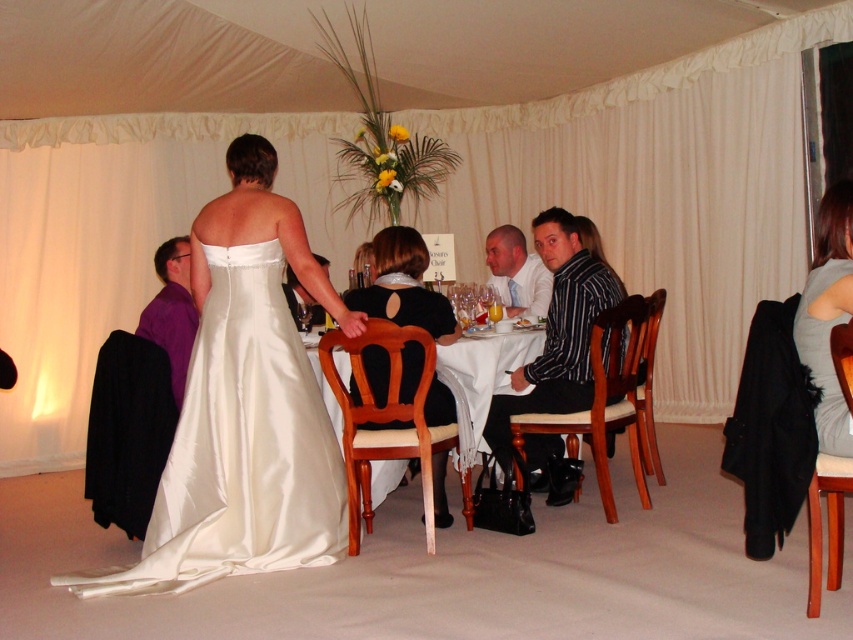
Does striped cotton shirt at center have a greater width compared to black satin dress at center?

Indeed, striped cotton shirt at center has a greater width compared to black satin dress at center.

Which is above, striped cotton shirt at center or black satin dress at center?

Positioned higher is striped cotton shirt at center.

Is point (503, 408) positioned after point (436, 381)?

Yes, point (503, 408) is farther from viewer.

Find the location of `striped cotton shirt at center`. striped cotton shirt at center is located at coordinates (556, 332).

Is point (283, 520) behind point (488, 250)?

No, (283, 520) is closer to viewer.

Does satin white dress at center appear on the right side of matte white shirt at center?

No, satin white dress at center is not to the right of matte white shirt at center.

Find the location of a particular element. The image size is (853, 640). satin white dress at center is located at coordinates (241, 448).

Between black satin dress at center and matte white shirt at center, which one appears on the left side from the viewer's perspective?

Positioned to the left is black satin dress at center.

The width and height of the screenshot is (853, 640). Find the location of `black satin dress at center`. black satin dress at center is located at coordinates (403, 285).

Where is `black satin dress at center`? The width and height of the screenshot is (853, 640). black satin dress at center is located at coordinates (403, 285).